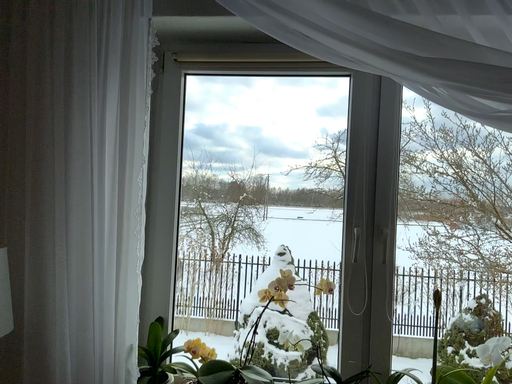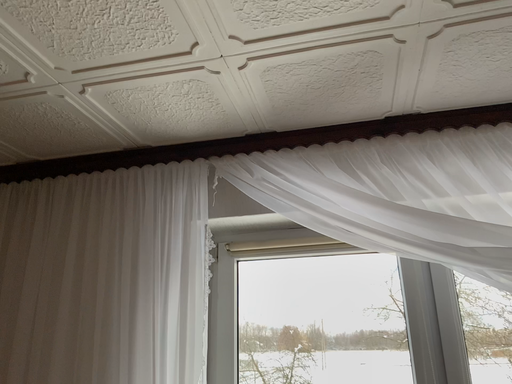
Question: Which way did the camera rotate in the video?

Choices:
 (A) rotated downward
 (B) rotated upward

Answer: (B)